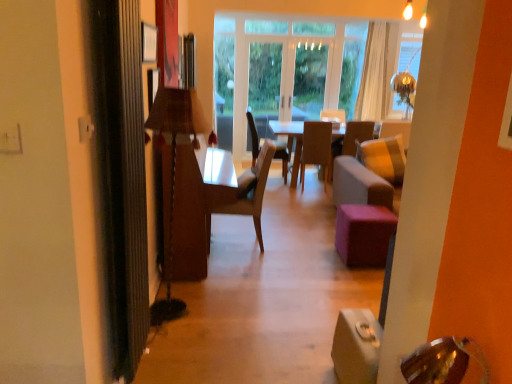
Identify the location of free region under brown leather chair at center, the third chair when ordered from left to right (from a real-world perspective). (315, 179).